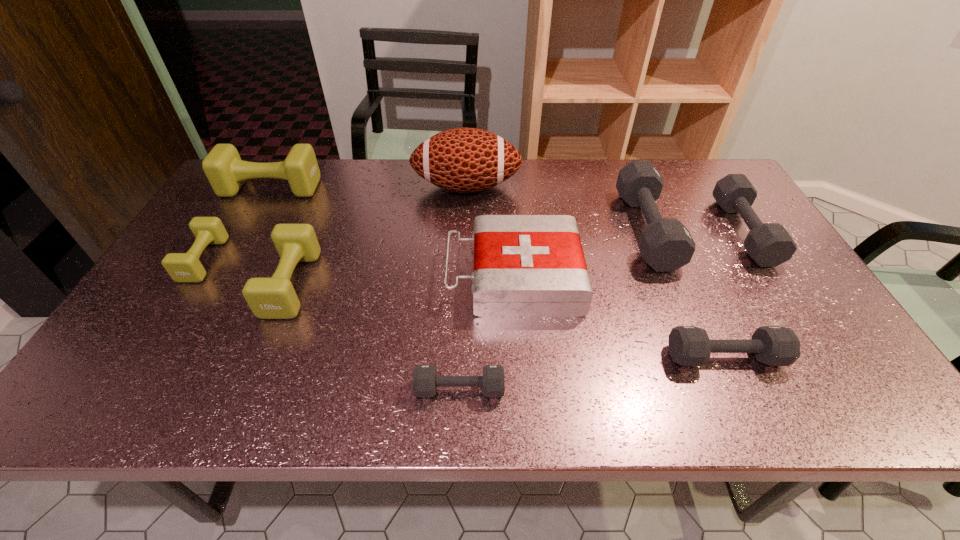
This screenshot has height=540, width=960. Identify the location of the shortest dumbbell. (425, 380).

In order to click on the smallest gray dumbbell in this screenshot , I will do `click(425, 380)`.

At what (x,y) coordinates should I click in order to perform the action: click on vacant space located on the left of the tallest object. Please return your answer as a coordinate pair (x, y). This screenshot has height=540, width=960. Looking at the image, I should click on (363, 187).

Identify the location of free space located 0.230m on the front of the biggest olive dumbbell. The width and height of the screenshot is (960, 540). (236, 249).

This screenshot has width=960, height=540. I want to click on blank area located 0.220m on the left of the biggest gray dumbbell, so click(548, 229).

Locate an element on the screen. The image size is (960, 540). vacant space located on the left of the second biggest olive dumbbell is located at coordinates (221, 284).

Identify the location of vacant area located on the front of the rightmost dumbbell. (776, 282).

At what (x,y) coordinates should I click in order to perform the action: click on vacant region located on the front side of the first-aid kit. Please return your answer as a coordinate pair (x, y). Looking at the image, I should click on (319, 276).

Where is `vacant point located on the front side of the first-aid kit`? vacant point located on the front side of the first-aid kit is located at coordinates (300, 276).

Identify the location of vacant area located 0.330m on the front side of the first-aid kit. The image size is (960, 540). (319, 276).